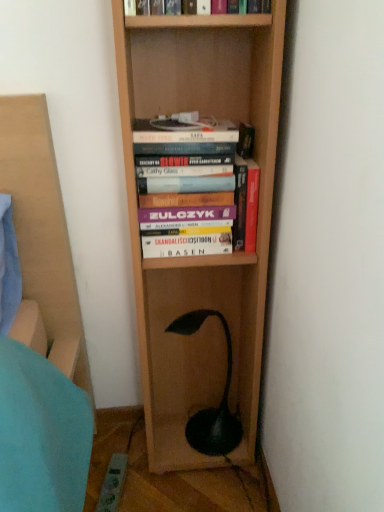
Question: Would you say hardcover books at center, the 2th book viewed from the top, is to the left or to the right of green matte lamp at lower center in the picture?

Choices:
 (A) left
 (B) right

Answer: (A)

Question: In the image, is hardcover books at center, the 2th book viewed from the top, positioned in front of or behind green matte lamp at lower center?

Choices:
 (A) front
 (B) behind

Answer: (A)

Question: Estimate the real-world distances between objects in this image. Which object is farther from the hardcover book at upper center, placed as the 1th book when sorted from top to bottom?

Choices:
 (A) hardcover books at center, the 2th book viewed from the top
 (B) hardcover book at center, the first book from the bottom
 (C) green matte lamp at lower center

Answer: (C)

Question: Which is nearer to the hardcover books at center, placed as the 2th book when sorted from bottom to top?

Choices:
 (A) hardcover book at center, acting as the 3th book starting from the top
 (B) green matte lamp at lower center
 (C) hardcover book at upper center, placed as the 1th book when sorted from top to bottom

Answer: (A)